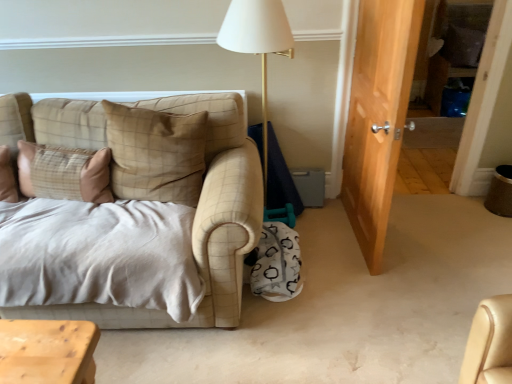
Question: Should I look upward or downward to see beige plaid pillow at upper left?

Choices:
 (A) up
 (B) down

Answer: (A)